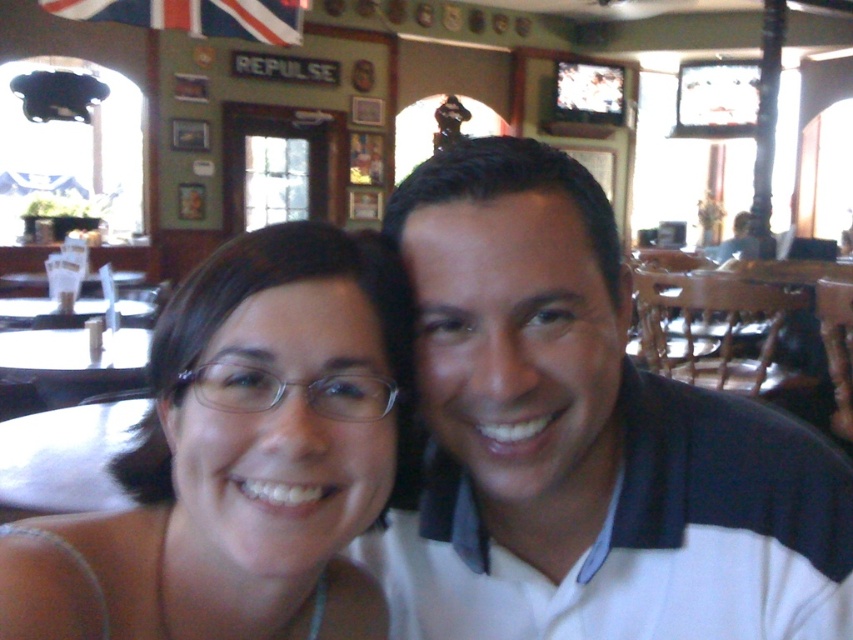
Question: Does white cotton shirt at center appear over matte white glasses at center?

Choices:
 (A) no
 (B) yes

Answer: (A)

Question: Which point is closer to the camera?

Choices:
 (A) matte white glasses at center
 (B) white cotton shirt at center

Answer: (A)

Question: Which of the following is the farthest from the observer?

Choices:
 (A) (68, 609)
 (B) (815, 445)

Answer: (B)

Question: Can you confirm if white cotton shirt at center is positioned above matte white glasses at center?

Choices:
 (A) no
 (B) yes

Answer: (A)

Question: Does white cotton shirt at center have a lesser width compared to matte white glasses at center?

Choices:
 (A) no
 (B) yes

Answer: (A)